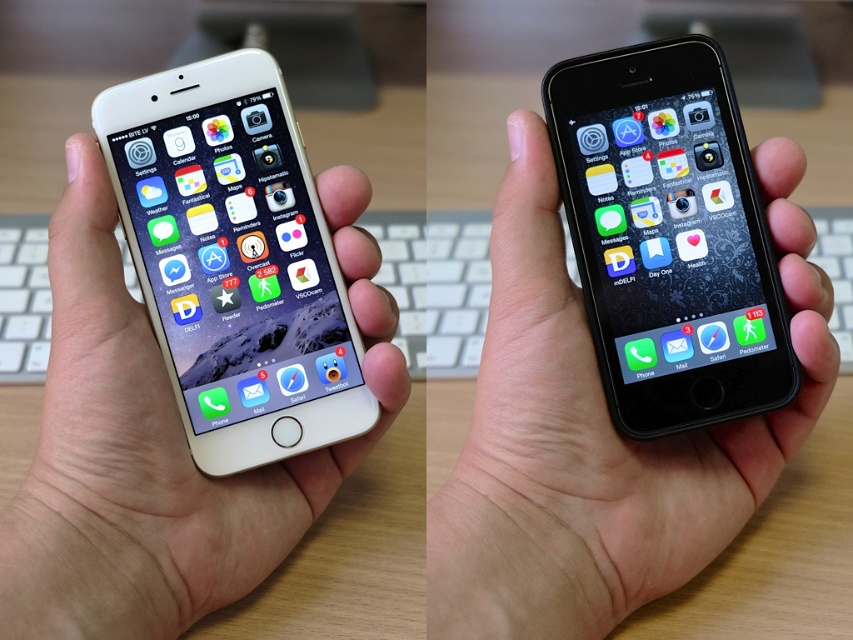
Question: Which point is farther to the camera?

Choices:
 (A) black matte phone at center
 (B) gold matte phone at left
 (C) gold matte iphone at center

Answer: (B)

Question: Is black matte phone at center positioned at the back of black matte smartphone at center?

Choices:
 (A) yes
 (B) no

Answer: (B)

Question: Which of the following is the farthest from the observer?

Choices:
 (A) (97, 481)
 (B) (527, 392)
 (C) (625, 161)

Answer: (C)

Question: Which of the following is the closest to the observer?

Choices:
 (A) (680, 51)
 (B) (74, 179)

Answer: (B)

Question: Does black matte phone at center have a lesser width compared to gold matte iphone at center?

Choices:
 (A) no
 (B) yes

Answer: (A)

Question: Observing the image, what is the correct spatial positioning of gold matte iphone at center in reference to black matte smartphone at center?

Choices:
 (A) below
 (B) above

Answer: (A)